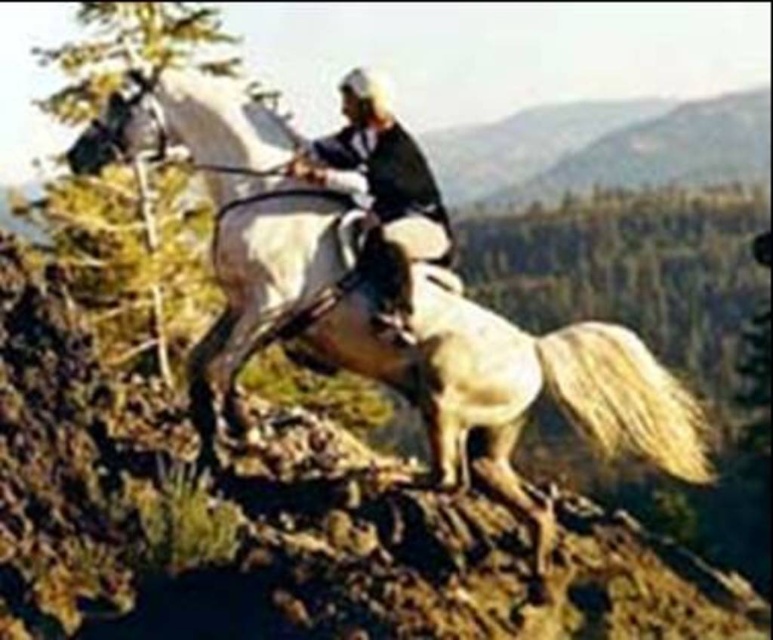
You are a painter standing at a distance, trying to capture the scene of the white glossy horse at center and the smooth leather jacket at center in your painting. You want to ensure the proportions are accurate. Which object should you paint wider in your artwork?

The white glossy horse at center should be painted wider than the smooth leather jacket at center because the white glossy horse at center is larger in width than the smooth leather jacket at center according to the description.